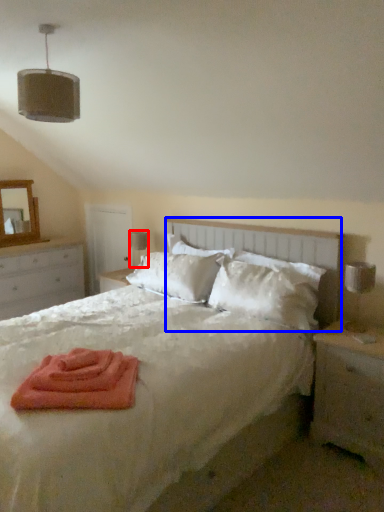
Question: Which object appears farthest to the camera in this image, table lamp (highlighted by a red box) or headboard (highlighted by a blue box)?

Choices:
 (A) table lamp
 (B) headboard

Answer: (A)